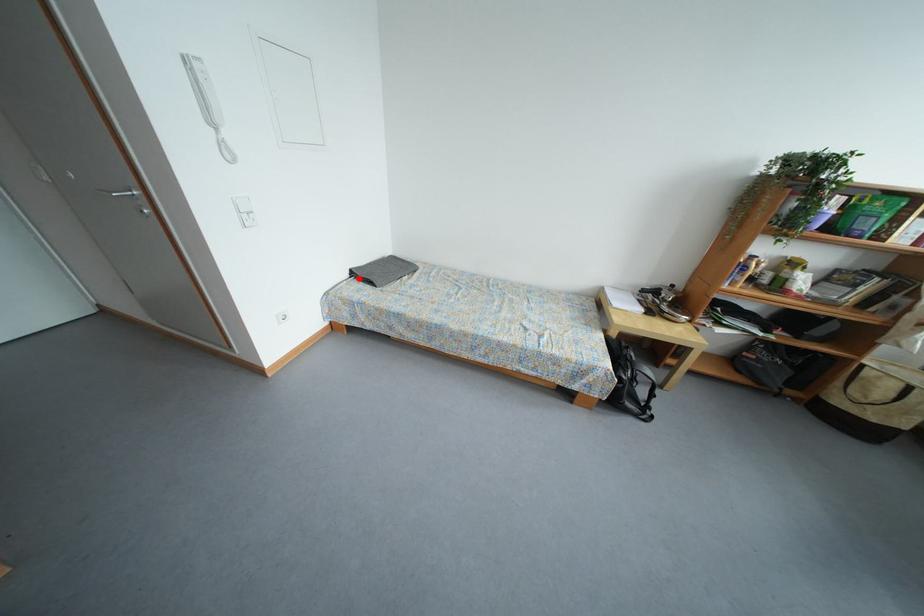
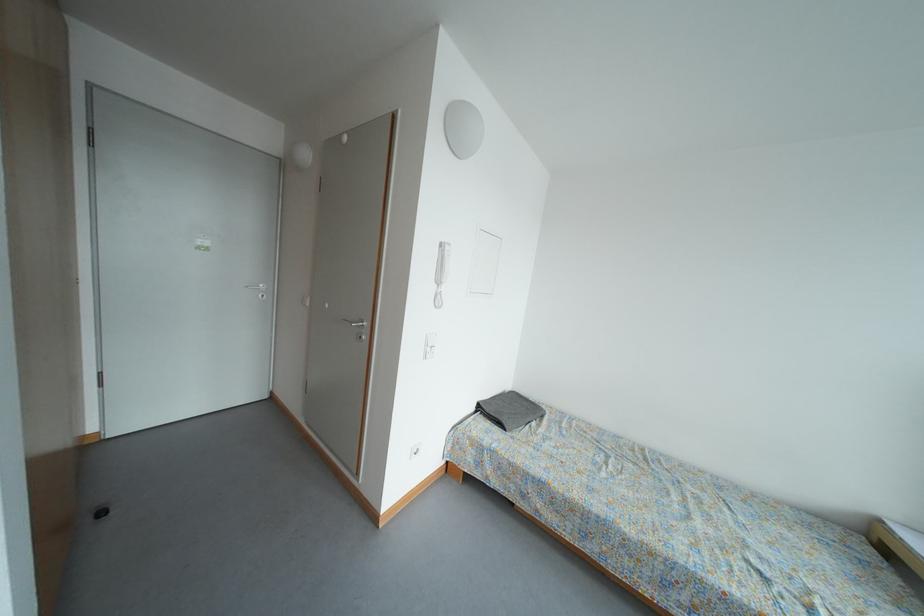
Question: I am providing you with two images of the same scene from different viewpoints. A red point is marked on the first image. Is the red point's position out of view in image 2?

Choices:
 (A) Yes
 (B) No

Answer: (B)